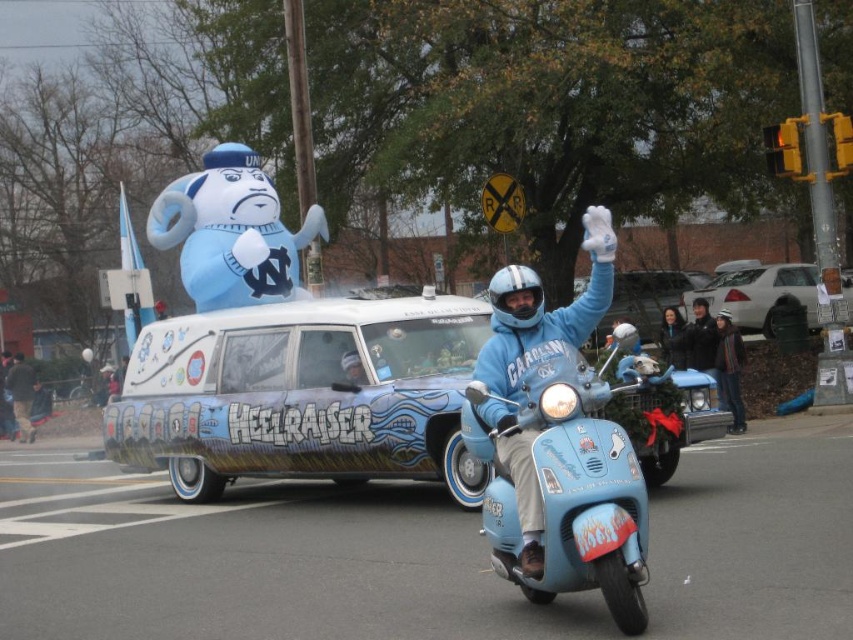
Is denim jacket at lower right in front of blue fabric jacket at center?

Yes.

The width and height of the screenshot is (853, 640). Identify the location of denim jacket at lower right. (729, 369).

Image resolution: width=853 pixels, height=640 pixels. What do you see at coordinates (729, 369) in the screenshot?
I see `denim jacket at lower right` at bounding box center [729, 369].

Image resolution: width=853 pixels, height=640 pixels. I want to click on denim jacket at lower right, so click(x=729, y=369).

Which is more to the right, light blue matte scooter at center or silver metallic sedan at right?

From the viewer's perspective, silver metallic sedan at right appears more on the right side.

Image resolution: width=853 pixels, height=640 pixels. What do you see at coordinates (569, 484) in the screenshot? I see `light blue matte scooter at center` at bounding box center [569, 484].

Is point (572, 392) positioned after point (799, 266)?

No.

The height and width of the screenshot is (640, 853). I want to click on light blue matte scooter at center, so click(x=569, y=484).

Can you confirm if light blue painted hearse at center is positioned above blue matte helmet at center?

Incorrect, light blue painted hearse at center is not positioned above blue matte helmet at center.

Between point (403, 413) and point (537, 525), which one is positioned behind?

Positioned behind is point (403, 413).

Locate an element on the screen. light blue painted hearse at center is located at coordinates (303, 394).